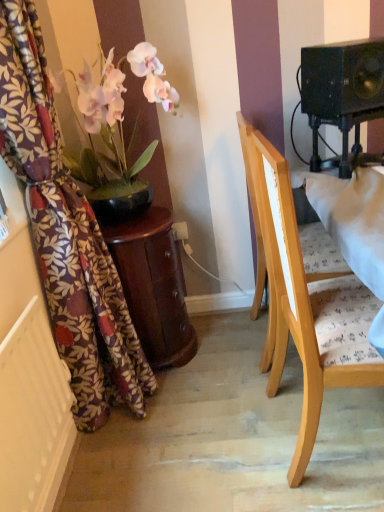
Question: Is white textured radiator at lower left not within floral fabric curtain at left?

Choices:
 (A) no
 (B) yes

Answer: (B)

Question: From a real-world perspective, is white textured radiator at lower left on floral fabric curtain at left?

Choices:
 (A) no
 (B) yes

Answer: (A)

Question: Is white textured radiator at lower left beside floral fabric curtain at left?

Choices:
 (A) yes
 (B) no

Answer: (B)

Question: Does white textured radiator at lower left have a lesser width compared to floral fabric curtain at left?

Choices:
 (A) no
 (B) yes

Answer: (B)

Question: Is white textured radiator at lower left turned away from floral fabric curtain at left?

Choices:
 (A) no
 (B) yes

Answer: (A)

Question: From a real-world perspective, is light wood chair at center above or below mahogany wood side table at left?

Choices:
 (A) above
 (B) below

Answer: (A)

Question: Is light wood chair at center to the left or to the right of mahogany wood side table at left in the image?

Choices:
 (A) right
 (B) left

Answer: (A)

Question: Considering their positions, is light wood chair at center located in front of or behind mahogany wood side table at left?

Choices:
 (A) front
 (B) behind

Answer: (A)

Question: Considering the positions of light wood chair at center and mahogany wood side table at left in the image, is light wood chair at center taller or shorter than mahogany wood side table at left?

Choices:
 (A) short
 (B) tall

Answer: (B)

Question: From a real-world perspective, is black matte speaker at upper right above or below light wood chair at center?

Choices:
 (A) above
 (B) below

Answer: (A)

Question: Considering the positions of point (359, 92) and point (297, 241), is point (359, 92) closer or farther from the camera than point (297, 241)?

Choices:
 (A) closer
 (B) farther

Answer: (A)

Question: In terms of height, does black matte speaker at upper right look taller or shorter compared to light wood chair at center?

Choices:
 (A) short
 (B) tall

Answer: (A)

Question: Relative to light wood chair at center, is black matte speaker at upper right in front or behind?

Choices:
 (A) behind
 (B) front

Answer: (A)

Question: Is mahogany wood side table at left taller or shorter than black matte speaker at upper right?

Choices:
 (A) tall
 (B) short

Answer: (A)

Question: Would you say mahogany wood side table at left is inside or outside black matte speaker at upper right?

Choices:
 (A) inside
 (B) outside

Answer: (B)